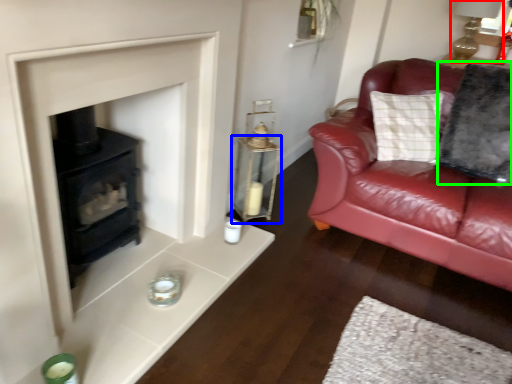
Question: Based on their relative distances, which object is nearer to oil lamp (highlighted by a red box)? Choose from table (highlighted by a blue box) and pillow (highlighted by a green box).

Choices:
 (A) table
 (B) pillow

Answer: (B)